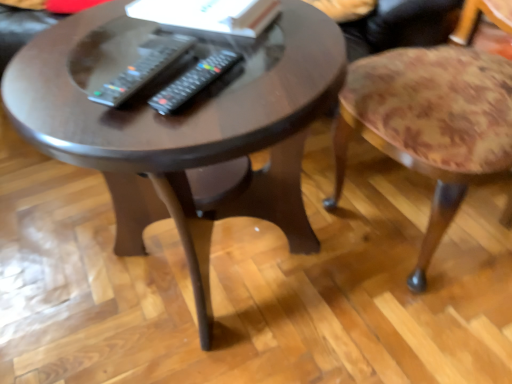
Find the location of a particular element. This screenshot has width=512, height=384. vacant point to the left of black plastic remote at center, which ranks as the second remote in right-to-left order is located at coordinates (46, 85).